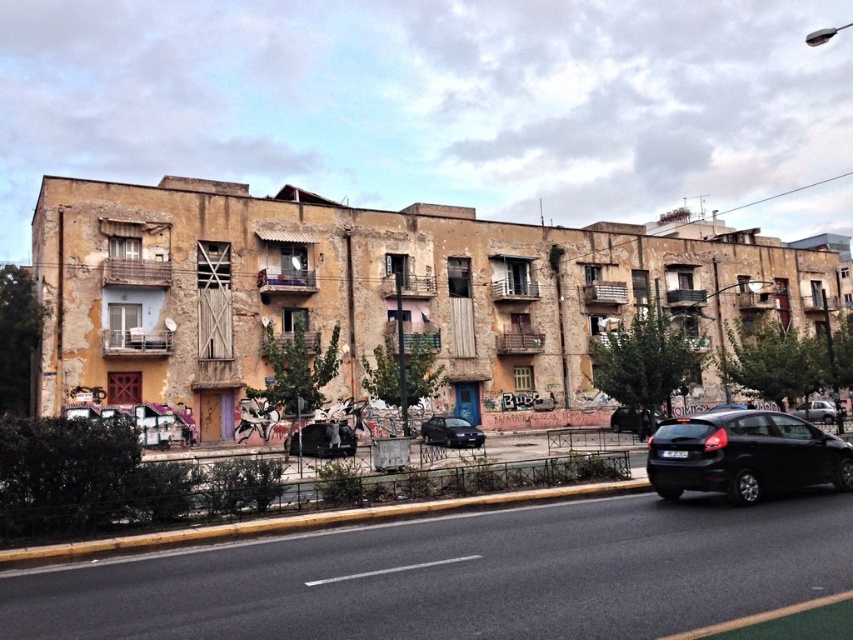
Question: Which of the following is the closest to the observer?

Choices:
 (A) metallic black car at center
 (B) shiny black car at center
 (C) silver metallic sedan at center-right
 (D) satin black sedan at center

Answer: (A)

Question: Considering the real-world distances, which object is farthest from the black matte hatchback at lower right?

Choices:
 (A) metallic black car at center
 (B) shiny black car at center
 (C) satin black sedan at center

Answer: (B)

Question: Can you confirm if black matte hatchback at lower right is positioned above shiny black car at center?

Choices:
 (A) no
 (B) yes

Answer: (B)

Question: In this image, where is black matte hatchback at lower right located relative to shiny black car at center?

Choices:
 (A) left
 (B) right

Answer: (A)

Question: Which object is closer to the camera taking this photo?

Choices:
 (A) black matte hatchback at lower right
 (B) silver metallic sedan at center-right

Answer: (A)

Question: Where is shiny black car at center located in relation to silver metallic sedan at center-right in the image?

Choices:
 (A) above
 (B) below

Answer: (A)